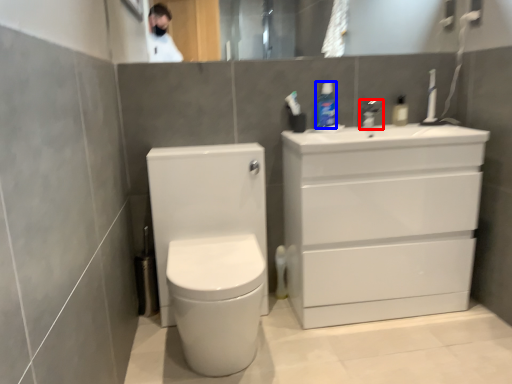
Question: Which of the following is the closest to the observer, tap (highlighted by a red box) or toiletry (highlighted by a blue box)?

Choices:
 (A) tap
 (B) toiletry

Answer: (B)